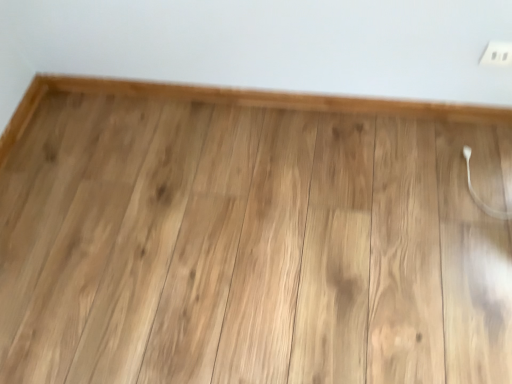
Locate an element on the screen. This screenshot has width=512, height=384. blank space situated above light wood ledge at upper center (from a real-world perspective) is located at coordinates (255, 91).